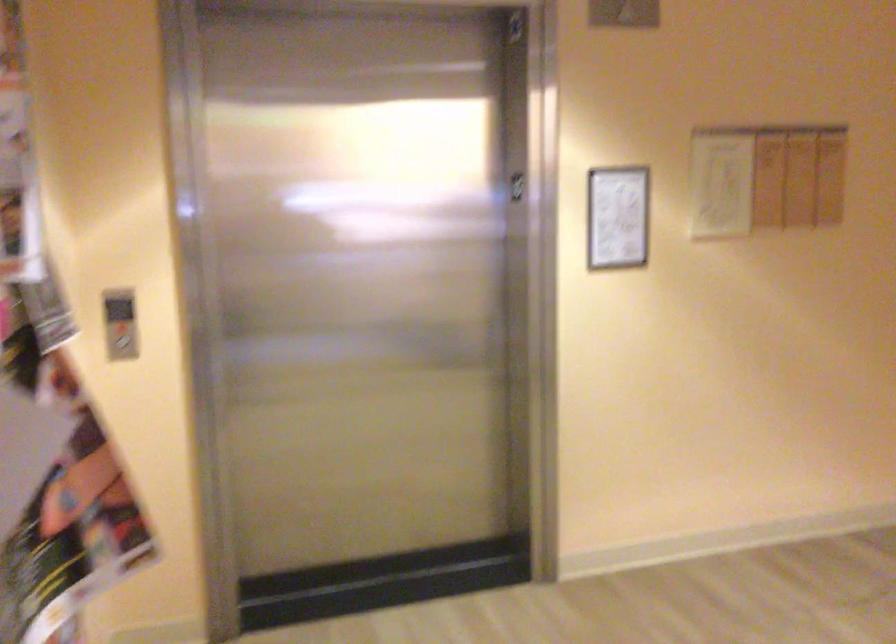
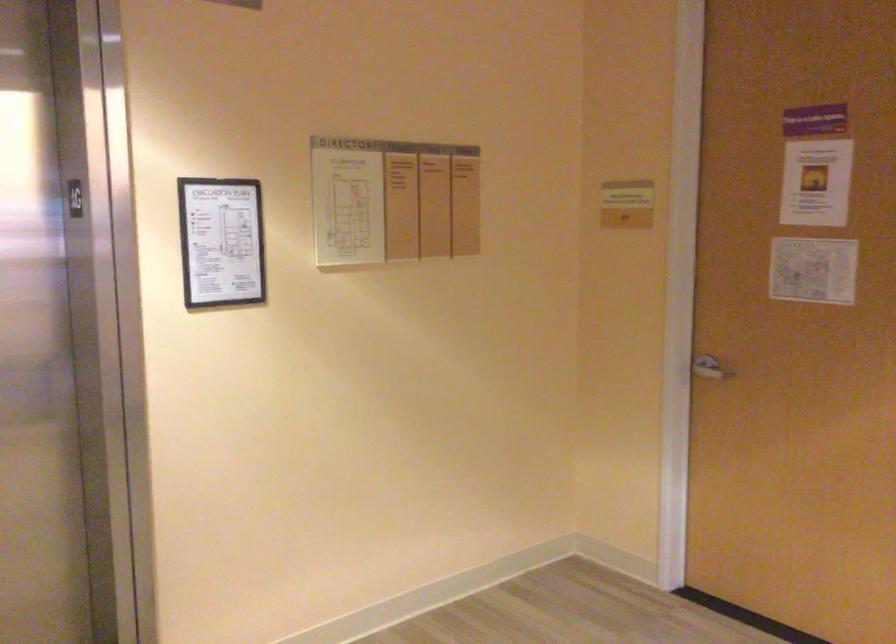
The images are taken continuously from a first-person perspective. In which direction are you moving?

The cameraman walked toward right, forward.